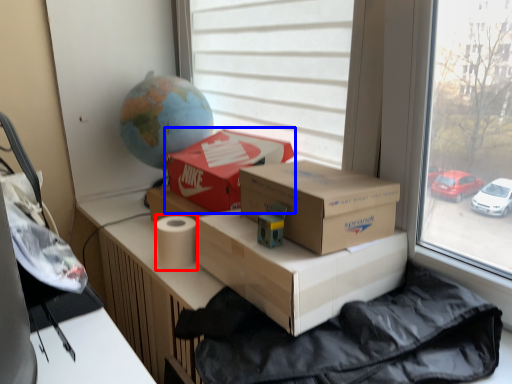
Question: Which of the following is the farthest to the observer, toilet paper (highlighted by a red box) or box (highlighted by a blue box)?

Choices:
 (A) toilet paper
 (B) box

Answer: (B)